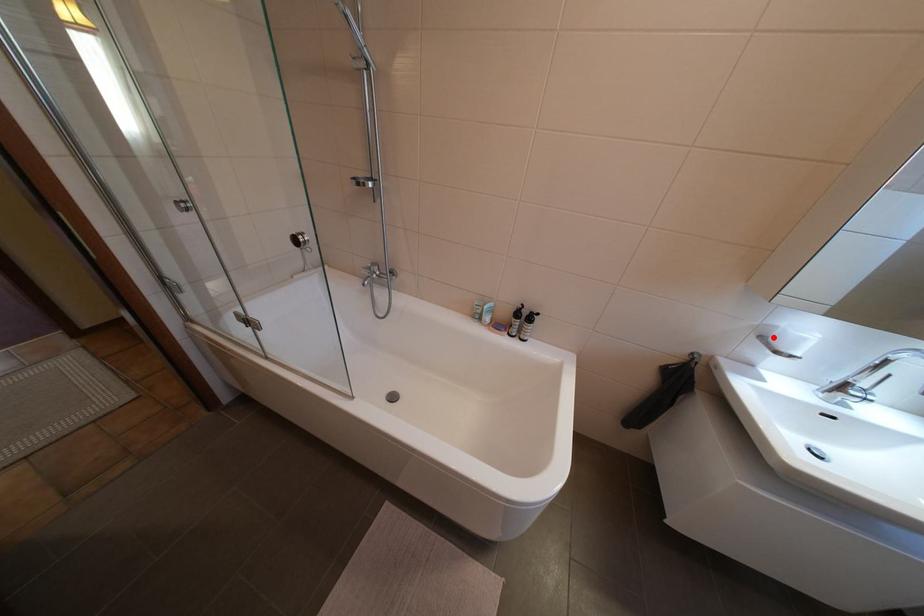
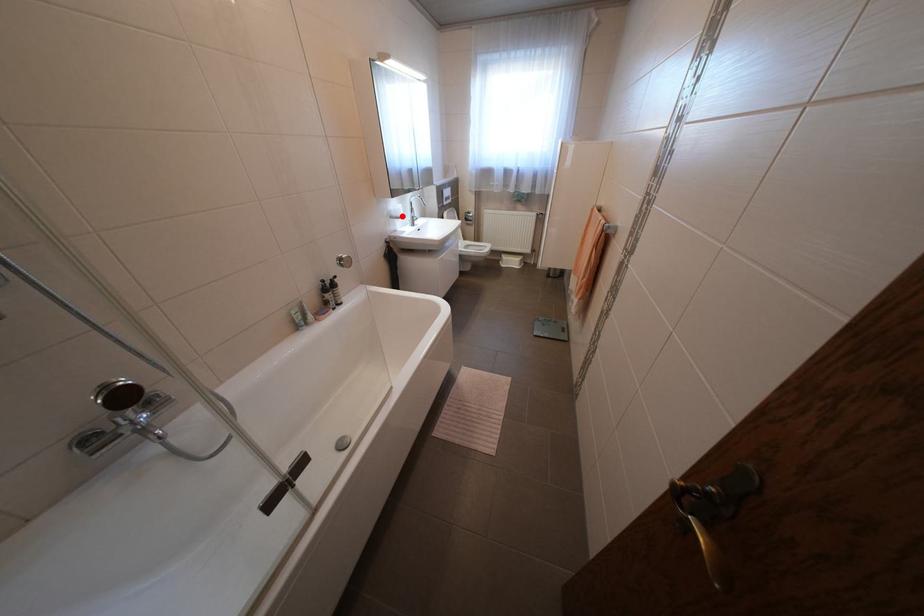
I am providing you with two images of the same scene from different viewpoints. A red point is marked on the first image and another point is marked on the second image. Is the marked point in image1 the same physical position as the marked point in image2?

Yes